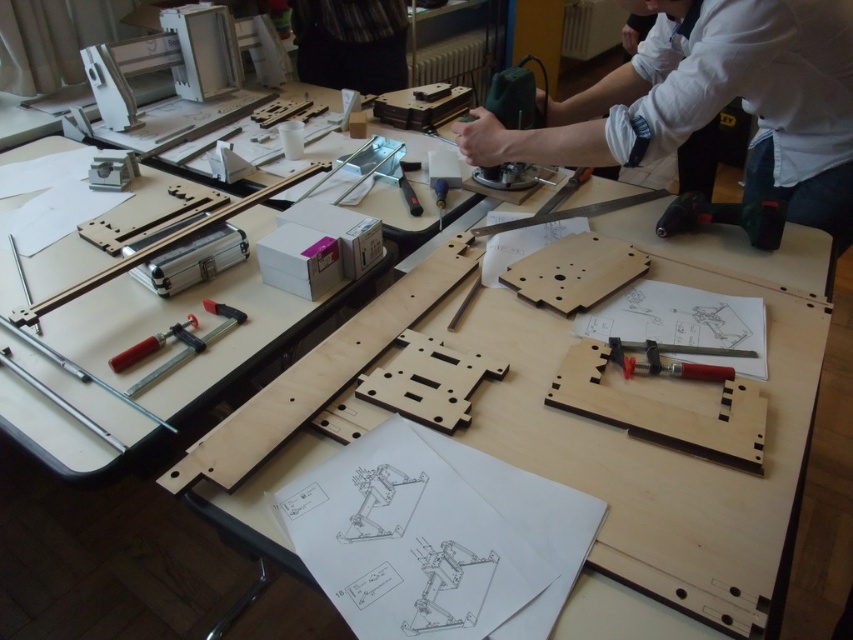
Is the white shirt at upper right wider than the matte black clamp at center?

The white shirt at upper right is wider than the matte black clamp at center according to the description.

Consider the image. You are a new worker in the workshop and need to identify the tools and clothing items. Which object is bigger between the white shirt at upper right and the matte black clamp at center?

The white shirt at upper right is larger in size than the matte black clamp at center.